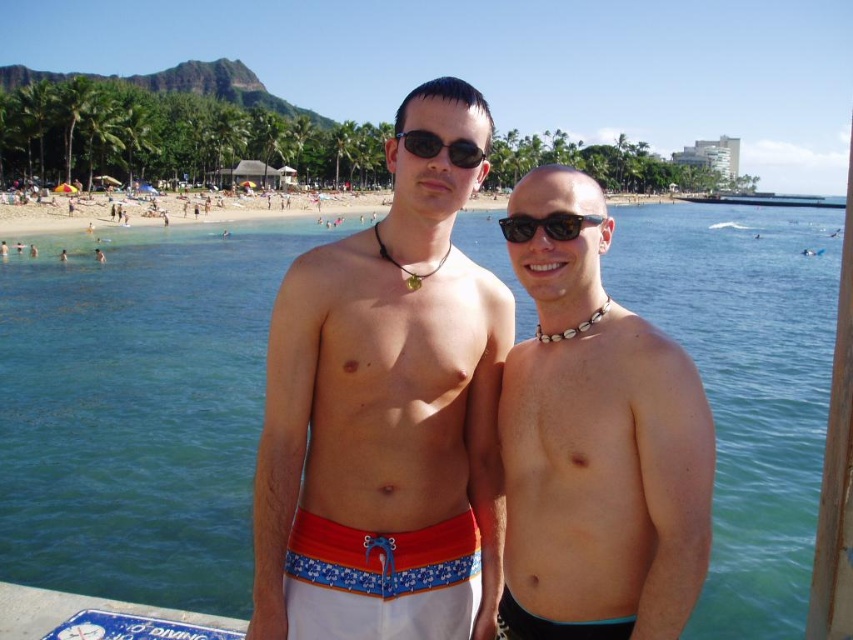
Which of these two, red and white swim trunks at center or black plastic sunglasses at center, stands taller?

With more height is red and white swim trunks at center.

Does point (293, 554) come in front of point (433, 141)?

Yes, point (293, 554) is in front of point (433, 141).

Who is more forward, (346, 598) or (425, 136)?

Point (346, 598)

Locate an element on the screen. This screenshot has height=640, width=853. red and white swim trunks at center is located at coordinates (381, 580).

Can you confirm if clear blue water at center is bigger than tortoiseshell plastic sunglasses at center?

Indeed, clear blue water at center has a larger size compared to tortoiseshell plastic sunglasses at center.

From the picture: Which is more to the right, clear blue water at center or tortoiseshell plastic sunglasses at center?

clear blue water at center

Is point (770, 620) positioned before point (585, 225)?

That is False.

Identify the location of clear blue water at center. The width and height of the screenshot is (853, 640). (137, 410).

Who is positioned more to the right, white swim trunks at center or beach sand at center?

beach sand at center is more to the right.

Is white swim trunks at center to the right of beach sand at center from the viewer's perspective?

No, white swim trunks at center is not to the right of beach sand at center.

Identify the location of white swim trunks at center. The image size is (853, 640). (386, 397).